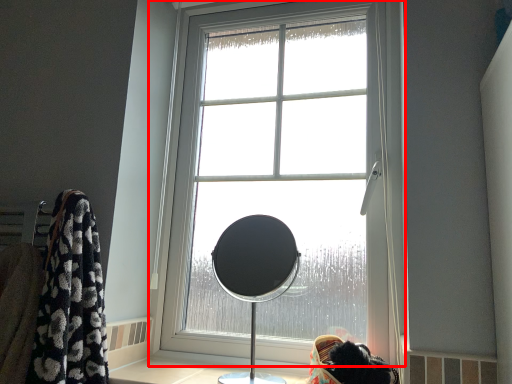
Question: Where is window (annotated by the red box) located in relation to table lamp in the image?

Choices:
 (A) right
 (B) left

Answer: (A)